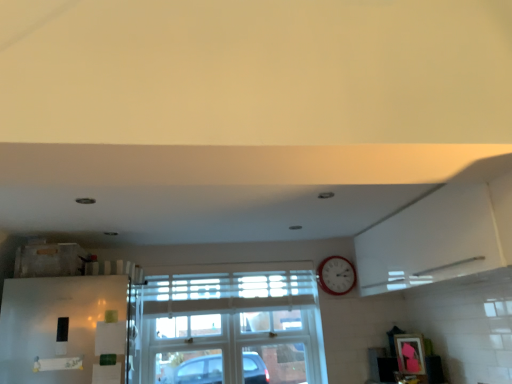
Question: Is clear glass window at center surrounded by metallic red clock at upper right?

Choices:
 (A) no
 (B) yes

Answer: (A)

Question: Is metallic red clock at upper right at the left side of clear glass window at center?

Choices:
 (A) no
 (B) yes

Answer: (A)

Question: Is metallic red clock at upper right positioned far away from clear glass window at center?

Choices:
 (A) yes
 (B) no

Answer: (B)

Question: Is metallic red clock at upper right to the right of clear glass window at center from the viewer's perspective?

Choices:
 (A) no
 (B) yes

Answer: (B)

Question: Is metallic red clock at upper right smaller than clear glass window at center?

Choices:
 (A) yes
 (B) no

Answer: (A)

Question: From a real-world perspective, is metallic red clock at upper right on clear glass window at center?

Choices:
 (A) no
 (B) yes

Answer: (B)

Question: From the image's perspective, is clear glass window at center beneath metallic red clock at upper right?

Choices:
 (A) yes
 (B) no

Answer: (A)

Question: Is clear glass window at center positioned before metallic red clock at upper right?

Choices:
 (A) no
 (B) yes

Answer: (B)

Question: Does clear glass window at center appear on the right side of metallic red clock at upper right?

Choices:
 (A) no
 (B) yes

Answer: (A)

Question: Is clear glass window at center outside metallic red clock at upper right?

Choices:
 (A) no
 (B) yes

Answer: (B)

Question: From the image's perspective, would you say clear glass window at center is positioned over metallic red clock at upper right?

Choices:
 (A) yes
 (B) no

Answer: (B)

Question: Does clear glass window at center turn towards metallic red clock at upper right?

Choices:
 (A) yes
 (B) no

Answer: (A)

Question: Based on their sizes in the image, would you say metallic red clock at upper right is bigger or smaller than clear glass window at center?

Choices:
 (A) small
 (B) big

Answer: (A)